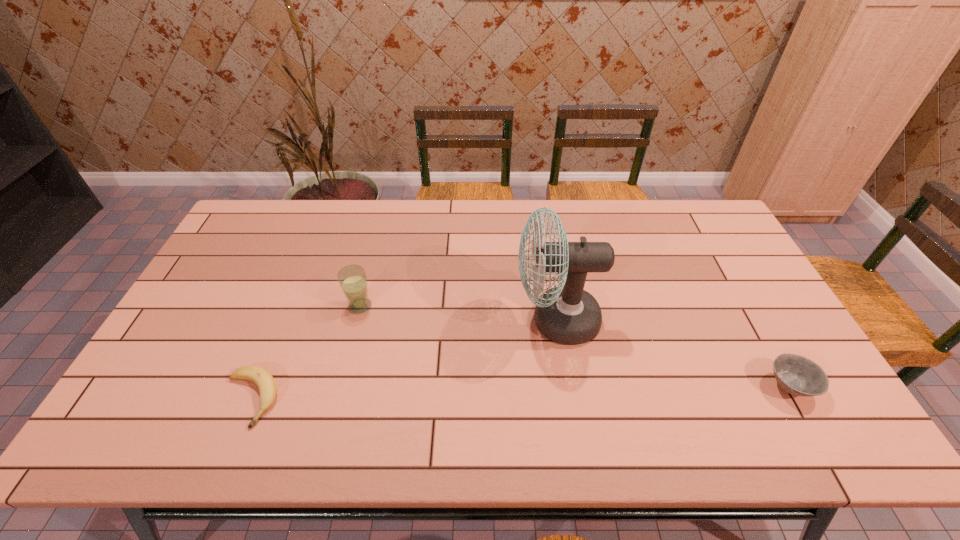
What are the coordinates of `vacant space that's between the rightmost object and the glass` in the screenshot? It's located at (575, 346).

Where is `free space between the third tallest object and the shortest object`? This screenshot has width=960, height=540. free space between the third tallest object and the shortest object is located at coordinates 519,393.

Where is `free spot between the bowl and the tallest object`? The image size is (960, 540). free spot between the bowl and the tallest object is located at coordinates (673, 354).

Find the location of a particular element. the third closest object to the glass is located at coordinates (797, 375).

Locate an element on the screen. object that stands as the closest to the shortest object is located at coordinates (352, 279).

Locate an element on the screen. free spot that satisfies the following two spatial constraints: 1. in front of the fan where the airflow is directed; 2. on the right side of the rightmost object is located at coordinates (567, 387).

Identify the location of vacant point that satisfies the following two spatial constraints: 1. in front of the rightmost object where the airflow is directed; 2. on the left side of the tallest object. The image size is (960, 540). (567, 387).

Locate an element on the screen. This screenshot has height=540, width=960. vacant space that satisfies the following two spatial constraints: 1. in front of the rightmost object where the airflow is directed; 2. on the left side of the fan is located at coordinates (567, 387).

You are a GUI agent. You are given a task and a screenshot of the screen. Output one action in this format:
    pyautogui.click(x=<x>, y=<y>)
    Task: Click on the vacant position in the image that satisfies the following two spatial constraints: 1. in front of the tallest object where the airflow is directed; 2. on the back side of the rightmost object
    
    Given the screenshot: What is the action you would take?
    pyautogui.click(x=567, y=387)